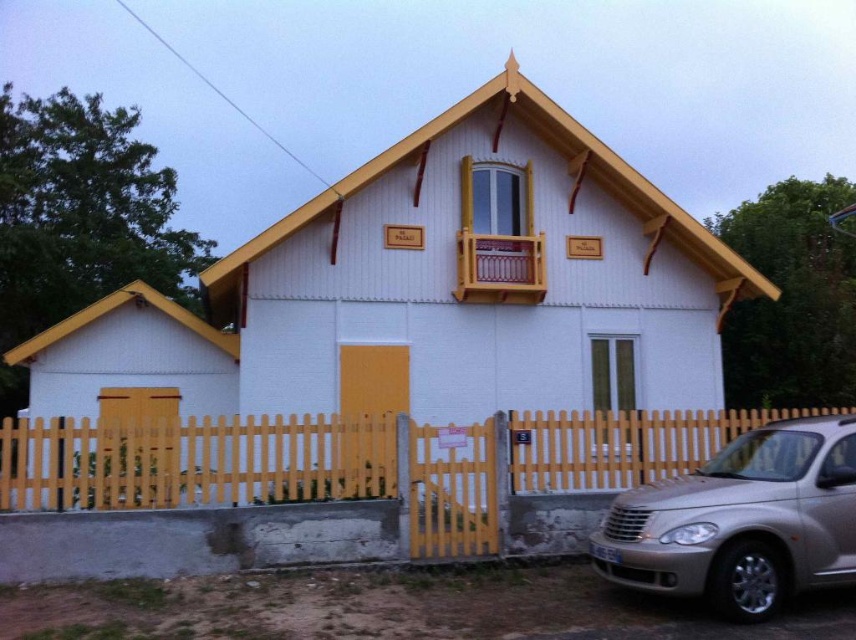
You are standing in front of the house and want to place a small potted plant exactly at point (194, 461). According to the scene description, what object will the plant be placed on?

The small potted plant will be placed on the yellow wooden fence at lower center located at point (194, 461).

You are standing in front of the house and want to know where the yellow wooden fence at lower center is located. Can you tell me its coordinates?

The yellow wooden fence at lower center is located at coordinates (194, 461).

You are a delivery person approaching the house and need to park your silver metallic car at lower right. The yellow wooden fence at lower center blocks your path. Can you drive around the fence to park your car?

The silver metallic car at lower right is already behind the yellow wooden fence at lower center, so you can park there without needing to go around the fence.